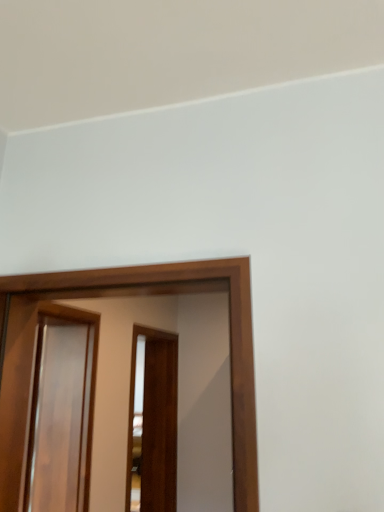
This screenshot has width=384, height=512. What do you see at coordinates (155, 422) in the screenshot? I see `brown wooden screen door at center, positioned as the third screen door in front-to-back order` at bounding box center [155, 422].

This screenshot has height=512, width=384. What do you see at coordinates (62, 411) in the screenshot? I see `glossy wood screen door at left, positioned as the 2th screen door in front-to-back order` at bounding box center [62, 411].

You are a GUI agent. You are given a task and a screenshot of the screen. Output one action in this format:
    pyautogui.click(x=<x>, y=<y>)
    Task: Click on the glossy wood screen door at left, positioned as the 2th screen door in front-to-back order
    The height and width of the screenshot is (512, 384).
    Given the screenshot: What is the action you would take?
    pyautogui.click(x=62, y=411)

How much space does glossy wood screen door at center, the 3th screen door when ordered from back to front, occupy vertically?

The height of glossy wood screen door at center, the 3th screen door when ordered from back to front, is 32.43 inches.

Where is `brown wooden screen door at center, which appears as the 1th screen door when viewed from the back`? The width and height of the screenshot is (384, 512). brown wooden screen door at center, which appears as the 1th screen door when viewed from the back is located at coordinates (155, 422).

Is glossy wood screen door at center, the 3th screen door when ordered from back to front, taller or shorter than brown wooden screen door at center, which appears as the 1th screen door when viewed from the back?

Considering their sizes, glossy wood screen door at center, the 3th screen door when ordered from back to front, has less height than brown wooden screen door at center, which appears as the 1th screen door when viewed from the back.

From a real-world perspective, who is located higher, glossy wood screen door at center, which appears as the first screen door when viewed from the front, or brown wooden screen door at center, which appears as the 1th screen door when viewed from the back?

From a 3D spatial view, glossy wood screen door at center, which appears as the first screen door when viewed from the front, is above.

Which of these two, glossy wood screen door at center, the 3th screen door when ordered from back to front, or brown wooden screen door at center, which appears as the 1th screen door when viewed from the back, is smaller?

Smaller between the two is glossy wood screen door at center, the 3th screen door when ordered from back to front.

Consider the image. Is glossy wood screen door at center, which appears as the first screen door when viewed from the front, oriented away from brown wooden screen door at center, which appears as the 1th screen door when viewed from the back?

Yes, glossy wood screen door at center, which appears as the first screen door when viewed from the front, is positioned with its back facing brown wooden screen door at center, which appears as the 1th screen door when viewed from the back.

From the picture: Does brown wooden screen door at center, positioned as the third screen door in front-to-back order, have a larger size compared to glossy wood screen door at center, which appears as the first screen door when viewed from the front?

Yes.

From a real-world perspective, count 2nd screen doors downward from the glossy wood screen door at center, the 3th screen door when ordered from back to front, and point to it. Please provide its 2D coordinates.

[(155, 422)]

Can you tell me how much brown wooden screen door at center, positioned as the third screen door in front-to-back order, and glossy wood screen door at center, which appears as the first screen door when viewed from the front, differ in facing direction?

92.5 degrees separate the facing orientations of brown wooden screen door at center, positioned as the third screen door in front-to-back order, and glossy wood screen door at center, which appears as the first screen door when viewed from the front.

How much distance is there between glossy wood screen door at center, the 3th screen door when ordered from back to front, and glossy wood screen door at left, which is the second screen door in back-to-front order?

29.31 inches.

From the picture: From the image's perspective, is glossy wood screen door at center, the 3th screen door when ordered from back to front, on top of glossy wood screen door at left, positioned as the 2th screen door in front-to-back order?

Yes, from the image's perspective, glossy wood screen door at center, the 3th screen door when ordered from back to front, is on top of glossy wood screen door at left, positioned as the 2th screen door in front-to-back order.

Looking at this image, is glossy wood screen door at center, which appears as the first screen door when viewed from the front, inside the boundaries of glossy wood screen door at left, which is the second screen door in back-to-front order, or outside?

glossy wood screen door at center, which appears as the first screen door when viewed from the front, exists outside the volume of glossy wood screen door at left, which is the second screen door in back-to-front order.

How different are the orientations of glossy wood screen door at center, which appears as the first screen door when viewed from the front, and glossy wood screen door at left, positioned as the 2th screen door in front-to-back order, in degrees?

96.8 degrees.

Which object is positioned more to the left, brown wooden screen door at center, which appears as the 1th screen door when viewed from the back, or glossy wood screen door at left, positioned as the 2th screen door in front-to-back order?

glossy wood screen door at left, positioned as the 2th screen door in front-to-back order.

Is brown wooden screen door at center, positioned as the third screen door in front-to-back order, smaller than glossy wood screen door at left, which is the second screen door in back-to-front order?

Incorrect, brown wooden screen door at center, positioned as the third screen door in front-to-back order, is not smaller in size than glossy wood screen door at left, which is the second screen door in back-to-front order.

Considering the positions of points (154, 387) and (65, 404), is point (154, 387) farther from camera compared to point (65, 404)?

Yes, point (154, 387) is farther from viewer.

Is brown wooden screen door at center, positioned as the third screen door in front-to-back order, located within glossy wood screen door at left, positioned as the 2th screen door in front-to-back order?

That's incorrect, brown wooden screen door at center, positioned as the third screen door in front-to-back order, is not inside glossy wood screen door at left, positioned as the 2th screen door in front-to-back order.

Is glossy wood screen door at left, which is the second screen door in back-to-front order, oriented towards brown wooden screen door at center, positioned as the third screen door in front-to-back order?

No, glossy wood screen door at left, which is the second screen door in back-to-front order, is not facing towards brown wooden screen door at center, positioned as the third screen door in front-to-back order.

Is glossy wood screen door at left, positioned as the 2th screen door in front-to-back order, with brown wooden screen door at center, which appears as the 1th screen door when viewed from the back?

No, glossy wood screen door at left, positioned as the 2th screen door in front-to-back order, is not making contact with brown wooden screen door at center, which appears as the 1th screen door when viewed from the back.

Who is shorter, glossy wood screen door at left, which is the second screen door in back-to-front order, or brown wooden screen door at center, positioned as the third screen door in front-to-back order?

Standing shorter between the two is glossy wood screen door at left, which is the second screen door in back-to-front order.

From a real-world perspective, who is located lower, glossy wood screen door at left, positioned as the 2th screen door in front-to-back order, or glossy wood screen door at center, which appears as the first screen door when viewed from the front?

In real-world perspective, glossy wood screen door at left, positioned as the 2th screen door in front-to-back order, is lower.

Would you consider glossy wood screen door at left, which is the second screen door in back-to-front order, to be distant from glossy wood screen door at center, which appears as the first screen door when viewed from the front?

Actually, glossy wood screen door at left, which is the second screen door in back-to-front order, and glossy wood screen door at center, which appears as the first screen door when viewed from the front, are a little close together.

Is point (54, 394) farther from viewer compared to point (239, 260)?

Yes, point (54, 394) is farther from viewer.

From the image's perspective, is glossy wood screen door at left, positioned as the 2th screen door in front-to-back order, located above or below glossy wood screen door at center, the 3th screen door when ordered from back to front?

From the image's perspective, glossy wood screen door at left, positioned as the 2th screen door in front-to-back order, appears below glossy wood screen door at center, the 3th screen door when ordered from back to front.

There is a glossy wood screen door at center, which appears as the first screen door when viewed from the front. Where is `the 2nd screen door below it (from the image's perspective)`? This screenshot has width=384, height=512. the 2nd screen door below it (from the image's perspective) is located at coordinates (155, 422).

From a real-world perspective, count 2nd screen doors upward from the brown wooden screen door at center, which appears as the 1th screen door when viewed from the back, and point to it. Please provide its 2D coordinates.

[(122, 295)]

Based on their spatial positions, is glossy wood screen door at center, which appears as the first screen door when viewed from the front, or glossy wood screen door at left, positioned as the 2th screen door in front-to-back order, closer to brown wooden screen door at center, positioned as the third screen door in front-to-back order?

The object closer to brown wooden screen door at center, positioned as the third screen door in front-to-back order, is glossy wood screen door at left, positioned as the 2th screen door in front-to-back order.

From the image, which object appears to be farther from glossy wood screen door at center, which appears as the first screen door when viewed from the front, glossy wood screen door at left, positioned as the 2th screen door in front-to-back order, or brown wooden screen door at center, which appears as the 1th screen door when viewed from the back?

Based on the image, brown wooden screen door at center, which appears as the 1th screen door when viewed from the back, appears to be further to glossy wood screen door at center, which appears as the first screen door when viewed from the front.

Based on their spatial positions, is glossy wood screen door at left, which is the second screen door in back-to-front order, or glossy wood screen door at center, which appears as the first screen door when viewed from the front, further from brown wooden screen door at center, which appears as the 1th screen door when viewed from the back?

glossy wood screen door at center, which appears as the first screen door when viewed from the front.

From the image, which object appears to be farther from glossy wood screen door at left, which is the second screen door in back-to-front order, brown wooden screen door at center, which appears as the 1th screen door when viewed from the back, or glossy wood screen door at center, the 3th screen door when ordered from back to front?

brown wooden screen door at center, which appears as the 1th screen door when viewed from the back, is further to glossy wood screen door at left, which is the second screen door in back-to-front order.

In the scene shown: Considering their positions, is brown wooden screen door at center, positioned as the third screen door in front-to-back order, positioned further to glossy wood screen door at center, which appears as the first screen door when viewed from the front, than glossy wood screen door at left, which is the second screen door in back-to-front order?

Among the two, brown wooden screen door at center, positioned as the third screen door in front-to-back order, is located further to glossy wood screen door at center, which appears as the first screen door when viewed from the front.

Looking at this image, based on their spatial positions, is glossy wood screen door at center, which appears as the first screen door when viewed from the front, or brown wooden screen door at center, which appears as the 1th screen door when viewed from the back, further from glossy wood screen door at left, positioned as the 2th screen door in front-to-back order?

brown wooden screen door at center, which appears as the 1th screen door when viewed from the back.

You are a GUI agent. You are given a task and a screenshot of the screen. Output one action in this format:
    pyautogui.click(x=<x>, y=<y>)
    Task: Click on the screen door located between glossy wood screen door at center, the 3th screen door when ordered from back to front, and brown wooden screen door at center, which appears as the 1th screen door when viewed from the back, in the depth direction
    This screenshot has width=384, height=512.
    Given the screenshot: What is the action you would take?
    pyautogui.click(x=62, y=411)